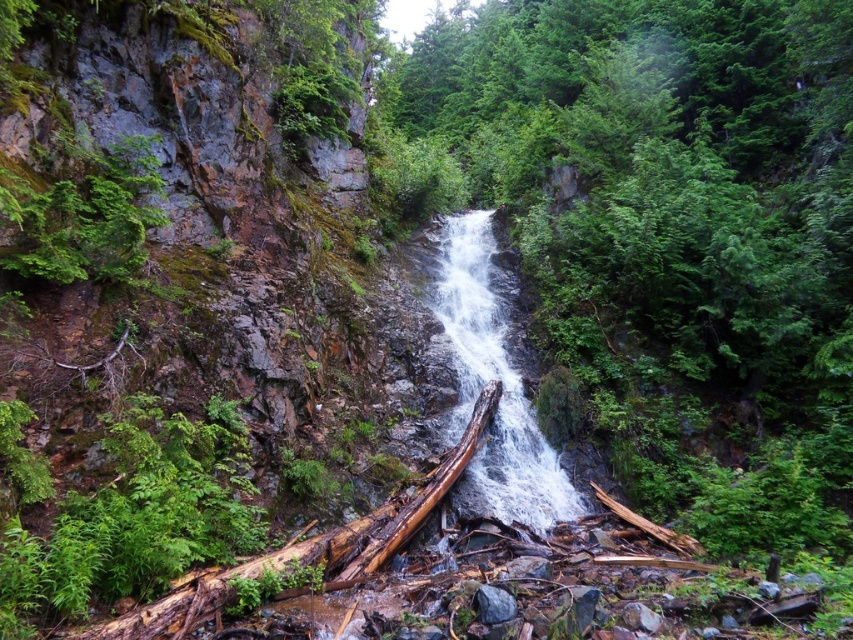
Question: Which point is closer to the camera?

Choices:
 (A) green rough log at center
 (B) white frothy water at center

Answer: (A)

Question: Which point appears closest to the camera in this image?

Choices:
 (A) (531, 419)
 (B) (564, 228)

Answer: (A)

Question: Can you confirm if green rough log at center is positioned to the right of white frothy water at center?

Choices:
 (A) no
 (B) yes

Answer: (B)

Question: Observing the image, what is the correct spatial positioning of green rough log at center in reference to white frothy water at center?

Choices:
 (A) above
 (B) below

Answer: (A)

Question: Is green rough log at center wider than white frothy water at center?

Choices:
 (A) no
 (B) yes

Answer: (B)

Question: Which point is farther to the camera?

Choices:
 (A) (477, 328)
 (B) (805, 141)

Answer: (B)